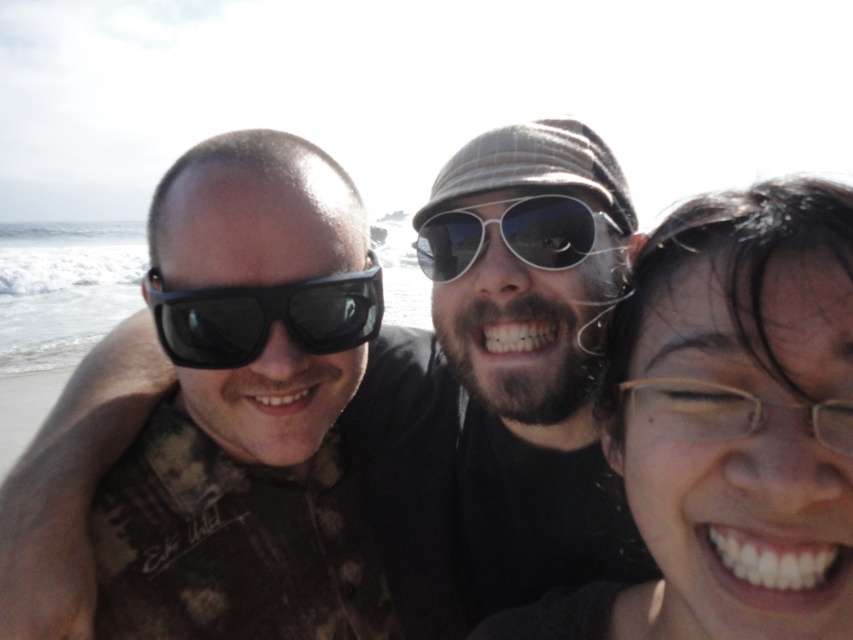
Question: Can you confirm if clear plastic glasses at center is positioned to the left of matte black sunglasses at left?

Choices:
 (A) yes
 (B) no

Answer: (B)

Question: Does clear plastic glasses at center have a greater width compared to metal aviator sunglasses at center?

Choices:
 (A) no
 (B) yes

Answer: (A)

Question: Does clear plastic glasses at center have a greater width compared to metal aviator sunglasses at center?

Choices:
 (A) no
 (B) yes

Answer: (A)

Question: Based on their relative distances, which object is nearer to the metal aviator sunglasses at center?

Choices:
 (A) matte black sunglasses at left
 (B) clear plastic glasses at center

Answer: (A)

Question: Which of these objects is positioned farthest from the metal aviator sunglasses at center?

Choices:
 (A) matte black sunglasses at left
 (B) clear plastic glasses at center

Answer: (B)

Question: Which object appears farthest from the camera in this image?

Choices:
 (A) clear plastic glasses at center
 (B) metal aviator sunglasses at center
 (C) matte black sunglasses at left

Answer: (B)